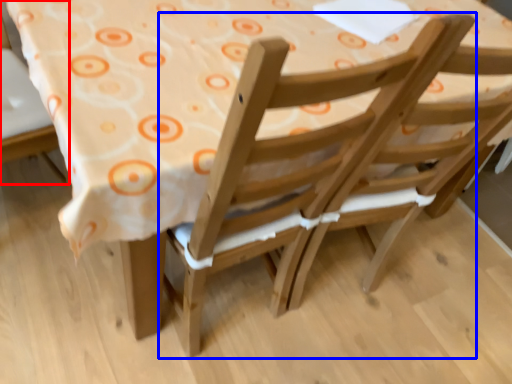
Question: Which of the following is the closest to the observer, chair (highlighted by a red box) or chair (highlighted by a blue box)?

Choices:
 (A) chair
 (B) chair

Answer: (B)